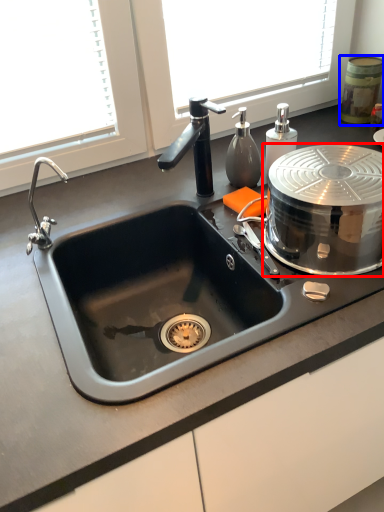
Question: Among these objects, which one is nearest to the camera, appliance (highlighted by a red box) or appliance (highlighted by a blue box)?

Choices:
 (A) appliance
 (B) appliance

Answer: (A)